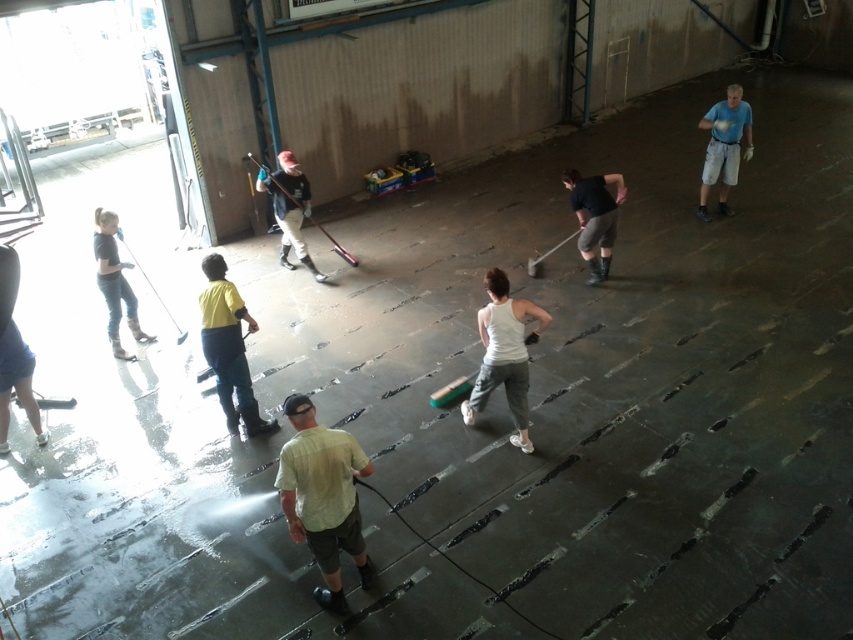
Is light green fabric shirt at center smaller than denim jeans at left?

No.

In the scene shown: Who is higher up, light green fabric shirt at center or denim jeans at left?

denim jeans at left

This screenshot has width=853, height=640. I want to click on light green fabric shirt at center, so (323, 497).

Is white matte tank top at center wider than blue t-shirt at upper right?

No.

Between point (498, 269) and point (732, 128), which one is positioned behind?

The point (732, 128) is more distant.

In order to click on white matte tank top at center in this screenshot , I will do `click(503, 355)`.

Is yellow fabric shirt at center further to the viewer compared to blue t-shirt at upper right?

No, yellow fabric shirt at center is closer to the viewer.

Between yellow fabric shirt at center and blue t-shirt at upper right, which one appears on the left side from the viewer's perspective?

yellow fabric shirt at center is more to the left.

Is point (245, 429) behind point (735, 176)?

No, (245, 429) is closer to viewer.

This screenshot has height=640, width=853. In order to click on yellow fabric shirt at center in this screenshot , I will do `click(228, 348)`.